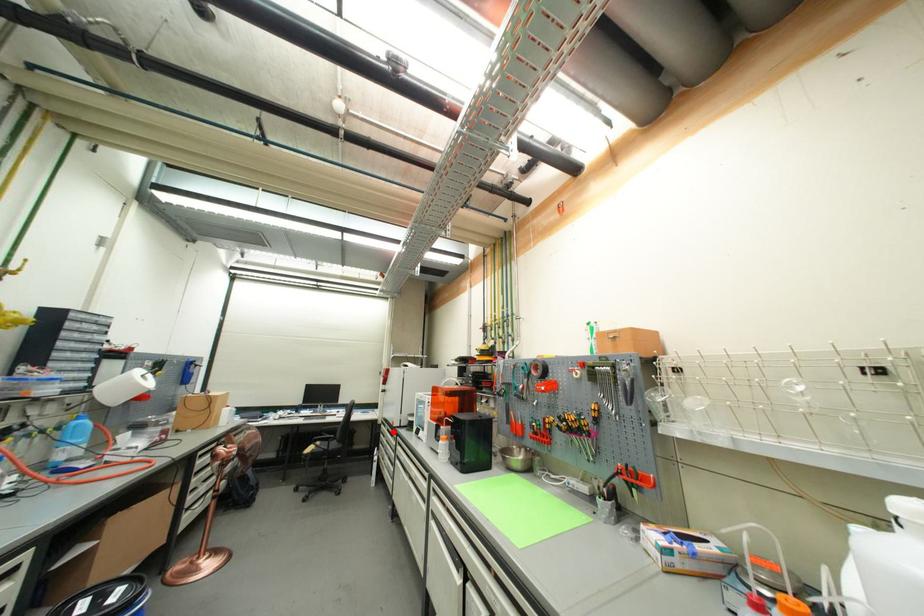
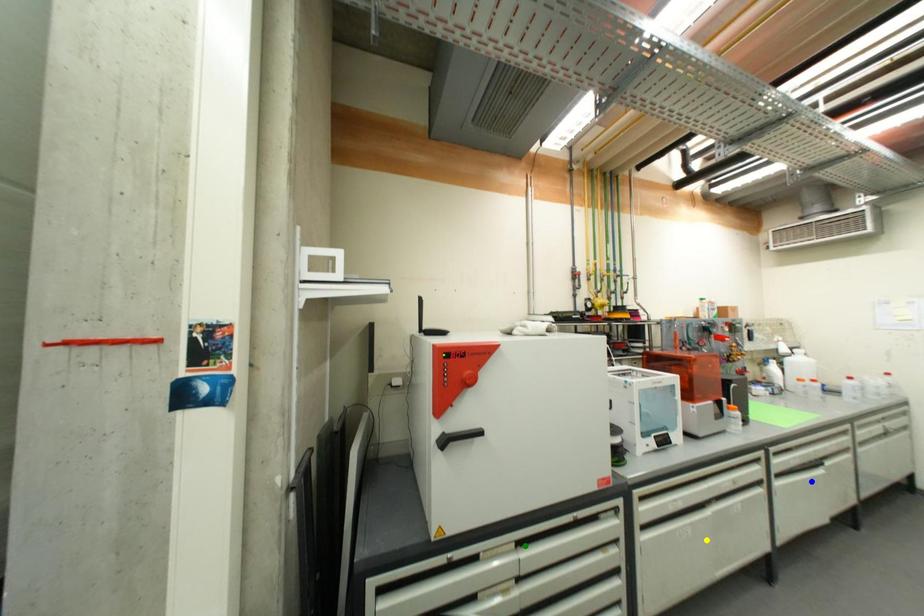
Question: I am providing you with two images of the same scene from different viewpoints. A red point is marked on the first image. You are given multiple points on the second image. Which point in image 2 represents the same 3d spot as the red point in image 1?

Choices:
 (A) yellow point
 (B) green point
 (C) blue point

Answer: (B)